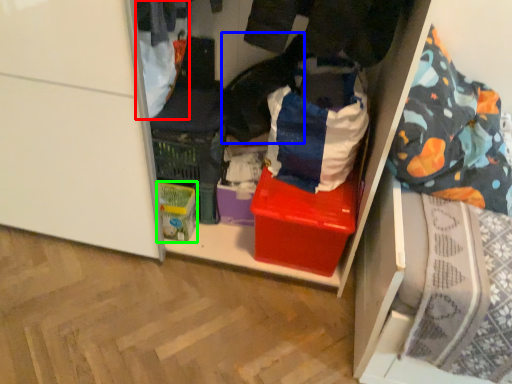
Question: Which object is positioned farthest from clothing (highlighted by a red box)? Select from clothing (highlighted by a blue box) and storage box (highlighted by a green box).

Choices:
 (A) clothing
 (B) storage box

Answer: (B)